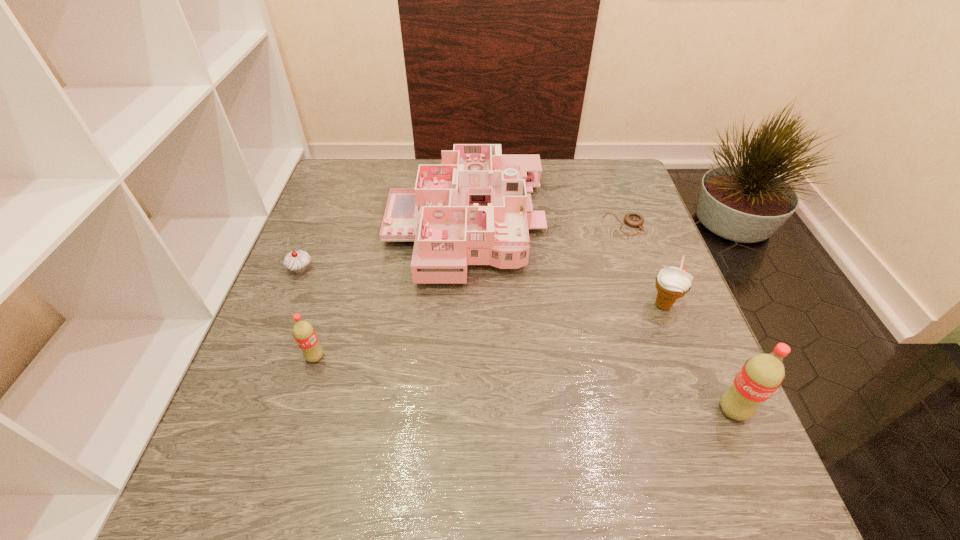
Locate an element on the screen. The width and height of the screenshot is (960, 540). vacant region located on the back of the nearer soda is located at coordinates (697, 327).

I want to click on free space located 0.100m at the front entrance of the dollhouse, so click(x=583, y=226).

The width and height of the screenshot is (960, 540). Identify the location of vacant space located on the left of the shortest object. (471, 224).

The width and height of the screenshot is (960, 540). Identify the location of free region located 0.150m on the front of the icecream. (691, 379).

The height and width of the screenshot is (540, 960). What are the coordinates of `blank area located on the front of the fifth tallest object` in the screenshot? It's located at (262, 368).

Where is `object that is at the far edge`? Image resolution: width=960 pixels, height=540 pixels. object that is at the far edge is located at coordinates (473, 209).

Identify the location of object that is at the near edge. The width and height of the screenshot is (960, 540). (761, 375).

Locate an element on the screen. This screenshot has height=540, width=960. soda located at the left edge is located at coordinates (304, 333).

Where is `cupcake present at the left edge`? The image size is (960, 540). cupcake present at the left edge is located at coordinates (297, 261).

Identify the location of soda that is at the right edge. (761, 375).